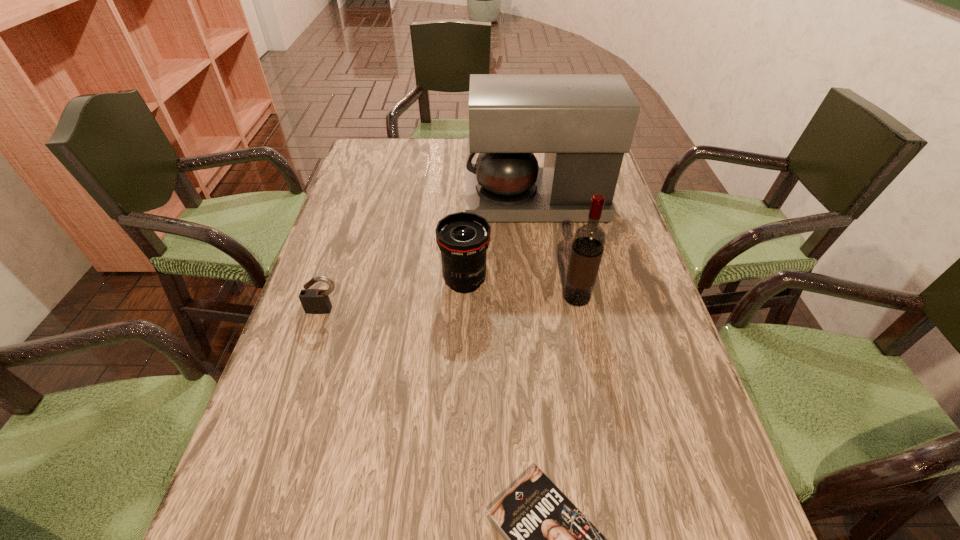
At what (x,y) coordinates should I click in order to perform the action: click on free region located 0.090m on the left of the telephoto lens. Please return your answer as a coordinate pair (x, y). This screenshot has height=540, width=960. Looking at the image, I should click on (402, 281).

Where is `vacant point located 0.350m with the keyhole on the front of the leftmost object`? vacant point located 0.350m with the keyhole on the front of the leftmost object is located at coordinates (272, 473).

This screenshot has width=960, height=540. What are the coordinates of `object located in the left edge section of the desktop` in the screenshot? It's located at (314, 301).

The height and width of the screenshot is (540, 960). Identify the location of coffee maker that is positioned at the right edge. (584, 123).

Find the location of `wine bottle that is at the right edge`. wine bottle that is at the right edge is located at coordinates (589, 239).

This screenshot has width=960, height=540. I want to click on vacant space at the far edge, so click(433, 147).

In the image, there is a desktop. At what (x,y) coordinates should I click in order to perform the action: click on free region at the left edge. Please return your answer as a coordinate pair (x, y). The width and height of the screenshot is (960, 540). Looking at the image, I should click on (335, 313).

The height and width of the screenshot is (540, 960). Identify the location of vacant space at the right edge. (633, 435).

Locate an element on the screen. vacant space at the far left corner of the desktop is located at coordinates (397, 139).

Identify the location of empty space between the coffee maker and the padlock. (430, 256).